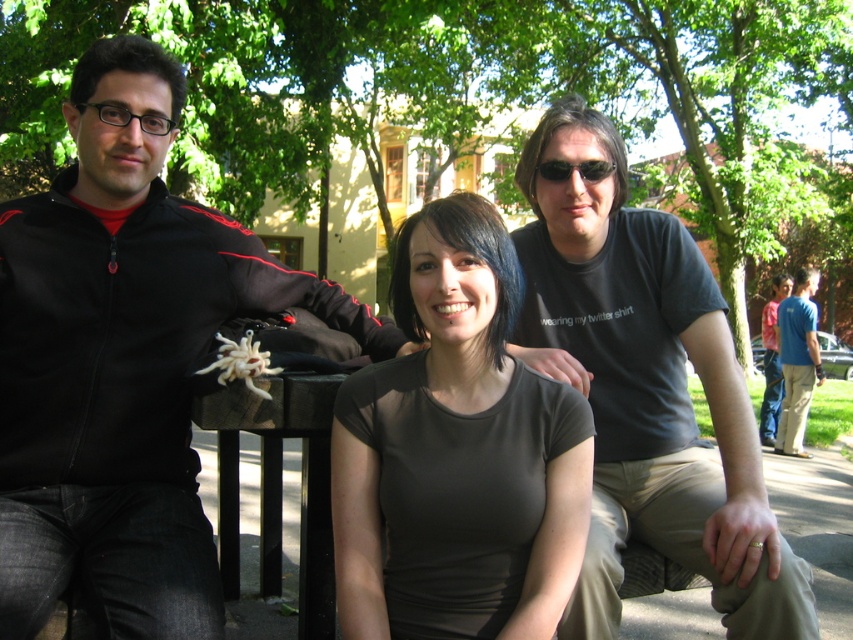
Is green leafy tree at upper center wider than sunglasses at center?

Correct, the width of green leafy tree at upper center exceeds that of sunglasses at center.

Which is behind, point (735, 310) or point (599, 173)?

The point (735, 310) is behind.

Between point (368, 0) and point (607, 173), which one is positioned in front?

Point (607, 173) is more forward.

Locate an element on the screen. green leafy tree at upper center is located at coordinates (454, 88).

Measure the distance between point (x=570, y=225) and camera.

Point (x=570, y=225) and camera are 2.41 meters apart.

Based on the photo, who is shorter, dark gray t-shirt at center or matte gray shirt at center?

matte gray shirt at center

Which is in front, point (614, 268) or point (451, 237)?

Point (451, 237) is in front.

Where is `dark gray t-shirt at center`? The image size is (853, 640). dark gray t-shirt at center is located at coordinates (647, 390).

Can you confirm if dark gray t-shirt at center is bigger than red shirt at right?

Indeed, dark gray t-shirt at center has a larger size compared to red shirt at right.

Is point (616, 544) positioned in front of point (781, 401)?

Yes, point (616, 544) is closer to viewer.

Identify the location of dark gray t-shirt at center. (647, 390).